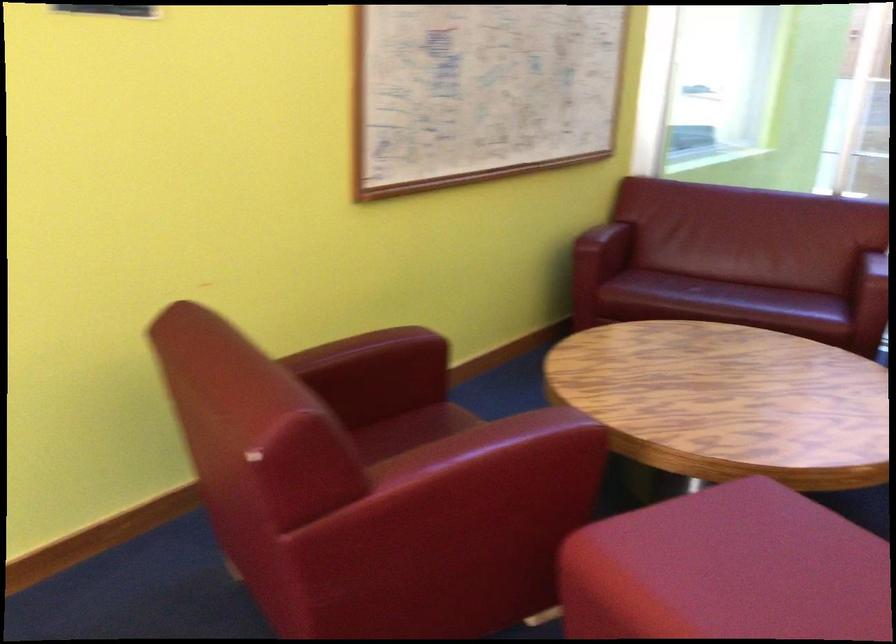
Describe the element at coordinates (872, 306) in the screenshot. I see `the sofa armrest` at that location.